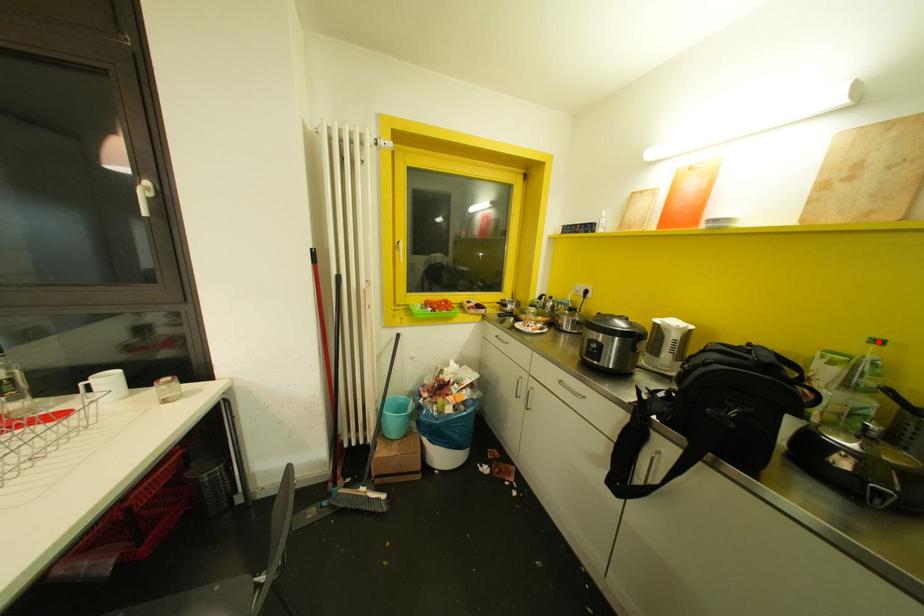
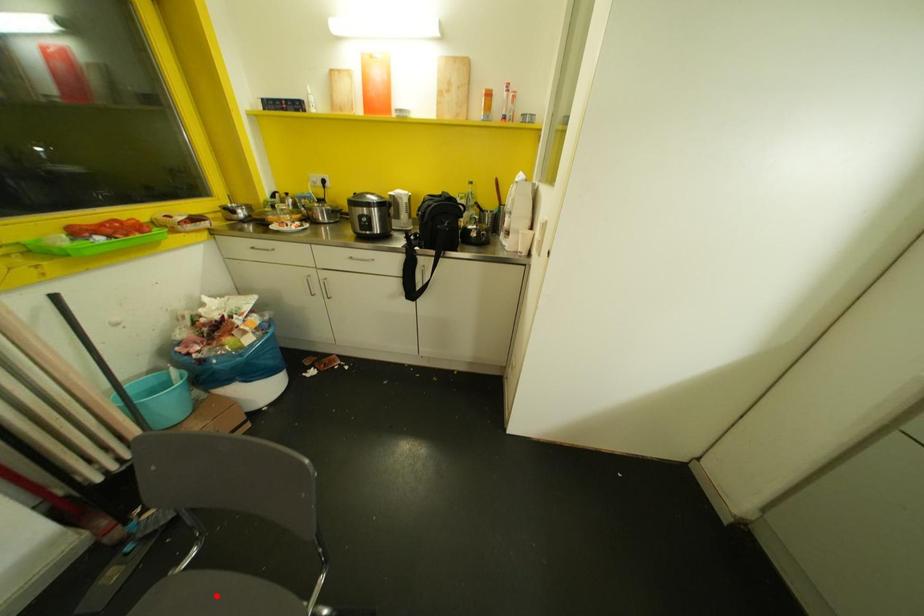
I am providing you with two images of the same scene from different viewpoints. A red point is marked on the first image and another point is marked on the second image. Is the marked point in image1 the same physical position as the marked point in image2?

No